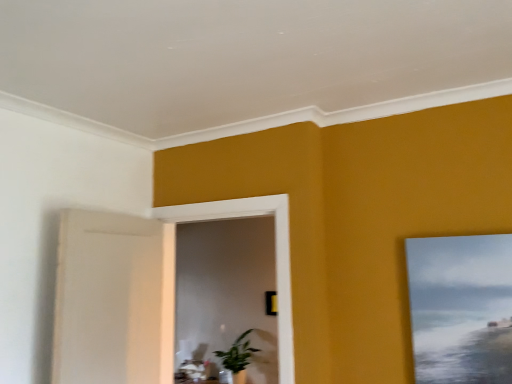
Question: From the image's perspective, is green glossy plant at center above or below matte canvas painting at upper right?

Choices:
 (A) below
 (B) above

Answer: (A)

Question: Relative to matte canvas painting at upper right, is green glossy plant at center in front or behind?

Choices:
 (A) front
 (B) behind

Answer: (B)

Question: Which object is positioned farthest from the white wooden frame at center?

Choices:
 (A) green glossy plant at center
 (B) matte canvas painting at upper right

Answer: (A)

Question: Which object is positioned closest to the matte canvas painting at upper right?

Choices:
 (A) green glossy plant at center
 (B) white wooden frame at center

Answer: (B)